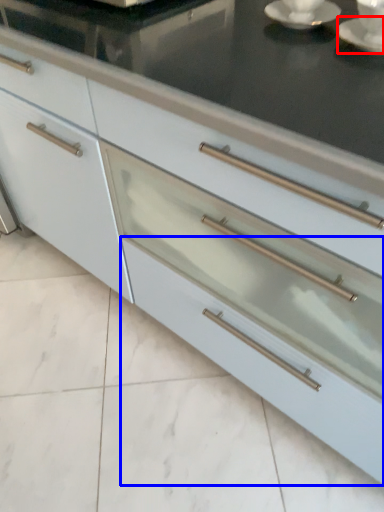
Question: Which point is further to the camera, saucer (highlighted by a red box) or drawer (highlighted by a blue box)?

Choices:
 (A) saucer
 (B) drawer

Answer: (B)